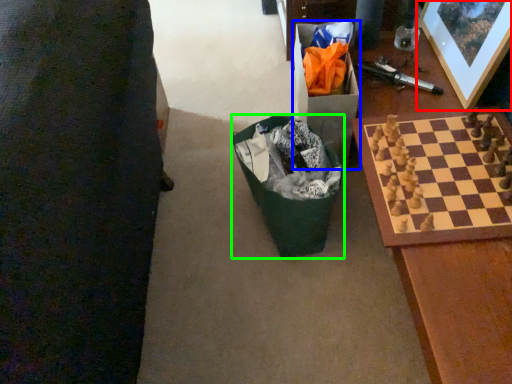
Question: Based on their relative distances, which object is farther from picture frame (highlighted by a red box)? Choose from cardboard box (highlighted by a blue box) and recycling bin (highlighted by a green box).

Choices:
 (A) cardboard box
 (B) recycling bin

Answer: (B)